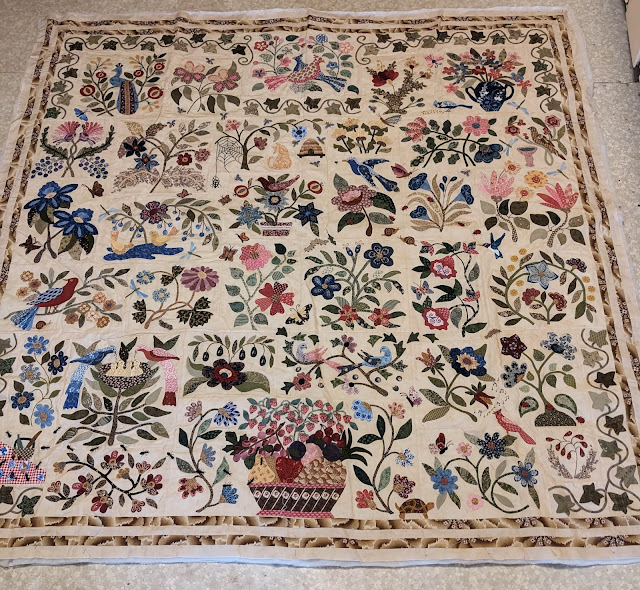
At what (x,y) coordinates should I click in order to perform the action: click on bowl. Please return your answer as a coordinate pair (x, y). This screenshot has height=590, width=640. Looking at the image, I should click on (292, 504).